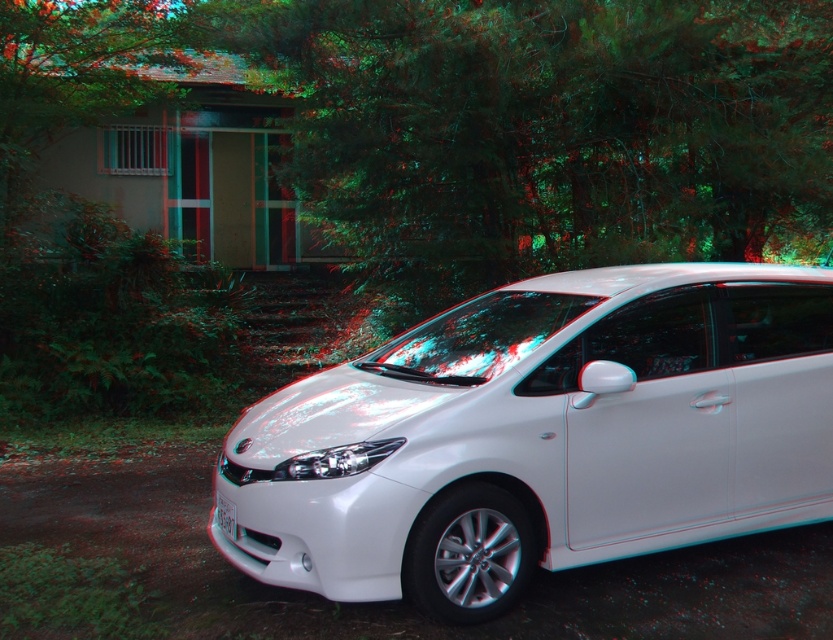
Question: Estimate the real-world distances between objects in this image. Which object is closer to the white glossy car at center?

Choices:
 (A) green leafy tree at center
 (B) white plastic license plate at center

Answer: (B)

Question: Is green leafy tree at center further to camera compared to white plastic license plate at center?

Choices:
 (A) yes
 (B) no

Answer: (A)

Question: Which is farther from the white plastic license plate at center?

Choices:
 (A) white glossy car at center
 (B) green leafy tree at center

Answer: (B)

Question: Can you confirm if green leafy tree at center is positioned below white plastic license plate at center?

Choices:
 (A) yes
 (B) no

Answer: (B)

Question: Which point is farther from the camera taking this photo?

Choices:
 (A) 268,83
 (B) 233,536
 (C) 213,492

Answer: (A)

Question: Can you confirm if white glossy car at center is positioned to the right of green leafy tree at center?

Choices:
 (A) yes
 (B) no

Answer: (A)